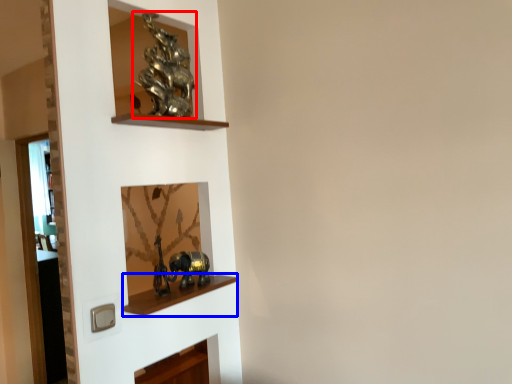
Question: Which object appears closest to the camera in this image, art (highlighted by a red box) or cabinet (highlighted by a blue box)?

Choices:
 (A) art
 (B) cabinet

Answer: (B)